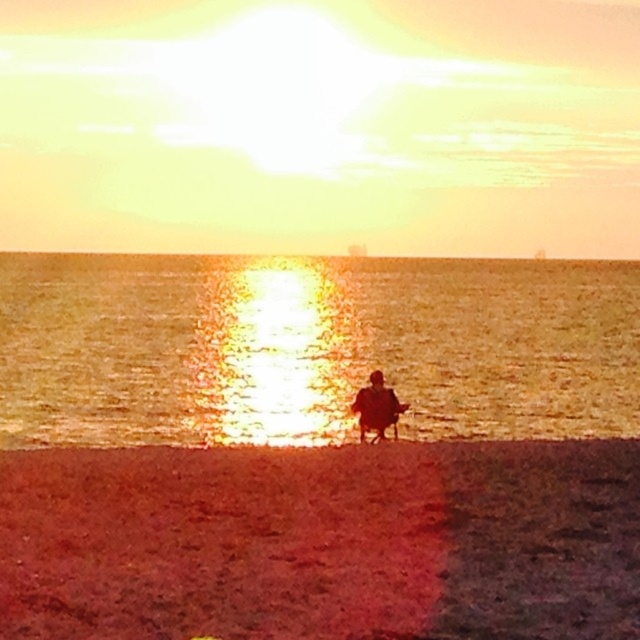
You are standing on the brown sandy beach at lower center and want to retrieve a seashell that is 10 meters away from you. Can you reach it without walking?

The brown sandy beach at lower center and viewer are 7.92 meters apart from each other. Since the seashell is 10 meters away from you, it is beyond the distance between you and the beach, so you cannot reach it without walking.

You are planning to build a small sandcastle on the brown sandy beach at lower center. Considering the size of the beach compared to the shiny golden water at center, will there be enough space for your sandcastle?

The brown sandy beach at lower center has a smaller size compared to the shiny golden water at center, so there might not be enough space for a sandcastle.

You are a photographer planning to capture the sunset scene. You have a camera with a 24mm lens that can capture a horizontal field of view of 80 degrees. You want to include both the brown sandy beach at lower center and the silhouette figure at center in your shot. Can the 24mm lens accommodate both objects in the frame?

The brown sandy beach at lower center might be wider than the silhouette figure at center, so using a 24mm lens with an 80 degree field of view should allow both objects to fit within the frame as the beach provides a broader base and the figure is centrally positioned.